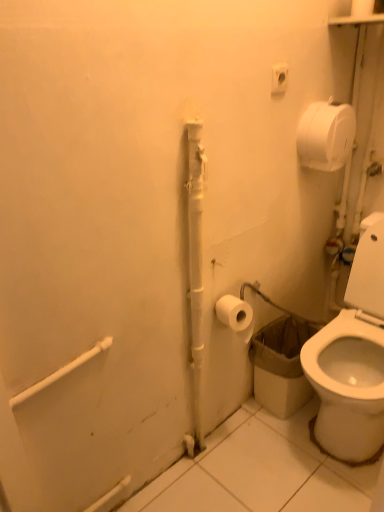
This screenshot has width=384, height=512. What do you see at coordinates (326, 135) in the screenshot? I see `white matte toilet paper at upper right, the first toilet paper positioned from the right` at bounding box center [326, 135].

Describe the element at coordinates (196, 266) in the screenshot. This screenshot has height=512, width=384. I see `white matte pipe at center` at that location.

At what (x,y) coordinates should I click in order to perform the action: click on white plastic outlet at upper center. Please return your answer as a coordinate pair (x, y). Image resolution: width=384 pixels, height=512 pixels. Looking at the image, I should click on (279, 78).

Which object is positioned more to the left, white matte toilet paper at upper right, which is the 2th toilet paper in left-to-right order, or white matte toilet paper at lower right, positioned as the second toilet paper in top-to-bottom order?

white matte toilet paper at lower right, positioned as the second toilet paper in top-to-bottom order, is more to the left.

From the image's perspective, does white matte toilet paper at upper right, the first toilet paper positioned from the right, appear lower than white matte toilet paper at lower right, arranged as the first toilet paper when viewed from the left?

Incorrect, from the image's perspective, white matte toilet paper at upper right, the first toilet paper positioned from the right, is higher than white matte toilet paper at lower right, arranged as the first toilet paper when viewed from the left.

Considering the sizes of white matte toilet paper at upper right, positioned as the first toilet paper in top-to-bottom order, and white matte toilet paper at lower right, positioned as the second toilet paper in top-to-bottom order, in the image, is white matte toilet paper at upper right, positioned as the first toilet paper in top-to-bottom order, wider or thinner than white matte toilet paper at lower right, positioned as the second toilet paper in top-to-bottom order,?

In the image, white matte toilet paper at upper right, positioned as the first toilet paper in top-to-bottom order, appears to be more narrow than white matte toilet paper at lower right, positioned as the second toilet paper in top-to-bottom order.

Looking at this image, between white matte toilet paper at upper right, which is the 2th toilet paper in left-to-right order, and white matte toilet paper at lower right, positioned as the second toilet paper in top-to-bottom order, which one has larger size?

white matte toilet paper at upper right, which is the 2th toilet paper in left-to-right order.

Is white plastic outlet at upper center completely or partially inside white matte pipe at center?

No.

Is the position of white matte pipe at center more distant than that of white plastic outlet at upper center?

No.

Which object is positioned more to the right, white matte pipe at center or white plastic outlet at upper center?

white plastic outlet at upper center is more to the right.

Considering the positions of point (196, 180) and point (279, 76), is point (196, 180) closer or farther from the camera than point (279, 76)?

Point (196, 180).

Find the location of a particular element. Image resolution: width=384 pixels, height=512 pixels. toilet paper on the right of the white plastic outlet at upper center is located at coordinates (326, 135).

How different are the orientations of white plastic outlet at upper center and white matte toilet paper at upper right, which is the 2th toilet paper in left-to-right order, in degrees?

1.3 degrees separate the facing orientations of white plastic outlet at upper center and white matte toilet paper at upper right, which is the 2th toilet paper in left-to-right order.

Which object is more forward, white plastic outlet at upper center or white matte toilet paper at upper right, which is the 2th toilet paper in left-to-right order?

white plastic outlet at upper center.

Considering the sizes of white plastic outlet at upper center and white matte toilet paper at upper right, positioned as the first toilet paper in top-to-bottom order, in the image, is white plastic outlet at upper center wider or thinner than white matte toilet paper at upper right, positioned as the first toilet paper in top-to-bottom order,?

white plastic outlet at upper center is thinner than white matte toilet paper at upper right, positioned as the first toilet paper in top-to-bottom order.

Is white plastic outlet at upper center at the right side of white matte pipe at center?

Yes, white plastic outlet at upper center is to the right of white matte pipe at center.

Based on the photo, does white plastic outlet at upper center have a lesser width compared to white matte pipe at center?

Indeed, white plastic outlet at upper center has a lesser width compared to white matte pipe at center.

Are white plastic outlet at upper center and white matte pipe at center far apart?

They are positioned close to each other.

Does white plastic outlet at upper center lie behind white matte pipe at center?

Yes.

Does point (226, 298) lie in front of point (200, 306)?

That is False.

Is white matte toilet paper at lower right, positioned as the second toilet paper in top-to-bottom order, wider or thinner than white matte pipe at center?

Clearly, white matte toilet paper at lower right, positioned as the second toilet paper in top-to-bottom order, has more width compared to white matte pipe at center.

Measure the distance between white matte toilet paper at lower right, arranged as the first toilet paper when viewed from the left, and white matte pipe at center.

They are 8.28 inches apart.

Is white matte toilet paper at lower right, positioned as the second toilet paper in top-to-bottom order, at the left side of white matte pipe at center?

No, white matte toilet paper at lower right, positioned as the second toilet paper in top-to-bottom order, is not to the left of white matte pipe at center.

Considering the positions of objects white matte pipe at center and white matte toilet paper at upper right, the first toilet paper positioned from the right, in the image provided, who is in front, white matte pipe at center or white matte toilet paper at upper right, the first toilet paper positioned from the right,?

→ white matte pipe at center is more forward.

Considering the positions of point (197, 197) and point (318, 118), is point (197, 197) closer or farther from the camera than point (318, 118)?

Clearly, point (197, 197) is closer to the camera than point (318, 118).

Is white matte pipe at center turned away from white matte toilet paper at upper right, the 2th toilet paper in the bottom-to-top sequence?

No, white matte pipe at center is not facing away from white matte toilet paper at upper right, the 2th toilet paper in the bottom-to-top sequence.

Is white matte toilet paper at upper right, the first toilet paper positioned from the right, completely or partially inside white matte pipe at center?

No, white matte toilet paper at upper right, the first toilet paper positioned from the right, is not surrounded by white matte pipe at center.

Which is behind, point (238, 331) or point (336, 157)?

Positioned behind is point (336, 157).

From the image's perspective, is white matte toilet paper at lower right, which is counted as the 2th toilet paper, starting from the right, located beneath white matte toilet paper at upper right, which is the 2th toilet paper in left-to-right order?

Yes.

This screenshot has height=512, width=384. I want to click on toilet paper that is below the white matte toilet paper at upper right, positioned as the first toilet paper in top-to-bottom order (from the image's perspective), so click(x=236, y=316).

Are white matte toilet paper at lower right, arranged as the first toilet paper when viewed from the left, and white matte toilet paper at upper right, the 2th toilet paper in the bottom-to-top sequence, located far from each other?

No, white matte toilet paper at lower right, arranged as the first toilet paper when viewed from the left, is not far away from white matte toilet paper at upper right, the 2th toilet paper in the bottom-to-top sequence.

This screenshot has height=512, width=384. What are the coordinates of `toilet paper that appears on the left of white matte toilet paper at upper right, positioned as the first toilet paper in top-to-bottom order` in the screenshot? It's located at (236, 316).

At what (x,y) coordinates should I click in order to perform the action: click on electric outlet that appears behind the white matte pipe at center. Please return your answer as a coordinate pair (x, y). Looking at the image, I should click on (279, 78).

Which object lies further to the anchor point white matte toilet paper at upper right, the 2th toilet paper in the bottom-to-top sequence, white plastic outlet at upper center or white matte toilet paper at lower right, positioned as the second toilet paper in top-to-bottom order?

white matte toilet paper at lower right, positioned as the second toilet paper in top-to-bottom order.

Consider the image. Looking at the image, which one is located further to white plastic outlet at upper center, white matte toilet paper at lower right, positioned as the second toilet paper in top-to-bottom order, or white matte toilet paper at upper right, which is the 2th toilet paper in left-to-right order?

white matte toilet paper at lower right, positioned as the second toilet paper in top-to-bottom order, is positioned further to the anchor white plastic outlet at upper center.

When comparing their distances from white matte toilet paper at upper right, positioned as the first toilet paper in top-to-bottom order, does white matte toilet paper at lower right, positioned as the second toilet paper in top-to-bottom order, or white matte pipe at center seem further?

white matte toilet paper at lower right, positioned as the second toilet paper in top-to-bottom order, is further to white matte toilet paper at upper right, positioned as the first toilet paper in top-to-bottom order.

When comparing their distances from white matte pipe at center, does white matte toilet paper at lower right, which is counted as the 2th toilet paper, starting from the right, or white matte toilet paper at upper right, the first toilet paper positioned from the right, seem further?

white matte toilet paper at upper right, the first toilet paper positioned from the right, lies further to white matte pipe at center than the other object.

When comparing their distances from white matte toilet paper at lower right, the first toilet paper from the bottom, does white matte pipe at center or white plastic outlet at upper center seem further?

Among the two, white plastic outlet at upper center is located further to white matte toilet paper at lower right, the first toilet paper from the bottom.

Estimate the real-world distances between objects in this image. Which object is further from white matte toilet paper at upper right, the 2th toilet paper in the bottom-to-top sequence, white matte toilet paper at lower right, which is counted as the 2th toilet paper, starting from the right, or white plastic outlet at upper center?

white matte toilet paper at lower right, which is counted as the 2th toilet paper, starting from the right, lies further to white matte toilet paper at upper right, the 2th toilet paper in the bottom-to-top sequence, than the other object.

Considering their positions, is white matte pipe at center positioned closer to white plastic outlet at upper center than white matte toilet paper at lower right, the first toilet paper from the bottom?

Among the two, white matte pipe at center is located nearer to white plastic outlet at upper center.

Estimate the real-world distances between objects in this image. Which object is further from white plastic outlet at upper center, white matte pipe at center or white matte toilet paper at upper right, the 2th toilet paper in the bottom-to-top sequence?

white matte pipe at center.

You are a GUI agent. You are given a task and a screenshot of the screen. Output one action in this format:
    pyautogui.click(x=<x>, y=<y>)
    Task: Click on the pipe between white matte toilet paper at upper right, the 2th toilet paper in the bottom-to-top sequence, and white matte toilet paper at lower right, arranged as the first toilet paper when viewed from the left, from top to bottom
    The height and width of the screenshot is (512, 384).
    Given the screenshot: What is the action you would take?
    pyautogui.click(x=196, y=266)

Identify the location of pipe that lies between white plastic outlet at upper center and white matte toilet paper at lower right, the first toilet paper from the bottom, from top to bottom. The width and height of the screenshot is (384, 512). (196, 266).

Locate an element on the screen. The image size is (384, 512). toilet paper between white plastic outlet at upper center and white matte toilet paper at lower right, the first toilet paper from the bottom, from top to bottom is located at coordinates (326, 135).

Find the location of `toilet paper between white plastic outlet at upper center and white matte pipe at center vertically`. toilet paper between white plastic outlet at upper center and white matte pipe at center vertically is located at coordinates (326, 135).